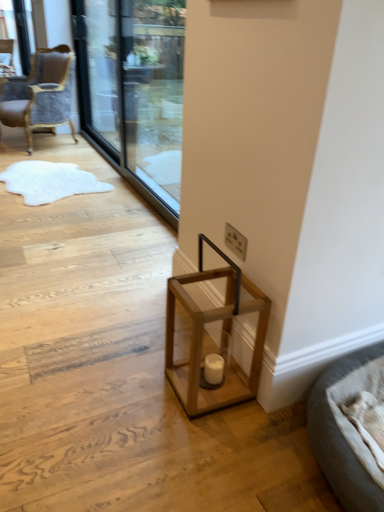
Where is `wooden lantern at lower center`? wooden lantern at lower center is located at coordinates (220, 344).

At what (x,y) coordinates should I click in order to perform the action: click on white plastic electric outlet at lower center. Please return your answer as a coordinate pair (x, y). This screenshot has height=512, width=384. Looking at the image, I should click on (235, 241).

Describe the element at coordinates (134, 90) in the screenshot. This screenshot has height=512, width=384. I see `transparent glass screen door at upper center, the 2th screen door viewed from the left` at that location.

This screenshot has height=512, width=384. Identify the location of velvet upholstered chair at upper left, the second chair positioned from the front. (6, 58).

Find the location of a particular element. This screenshot has height=512, width=384. gray fabric bed at lower right is located at coordinates (341, 439).

From the image's perspective, is velvet upholstered chair at upper left, which ranks as the 1th chair in back-to-front order, over transparent glass screen door at upper center, the 2th screen door viewed from the left?

Yes, from the image's perspective, velvet upholstered chair at upper left, which ranks as the 1th chair in back-to-front order, is above transparent glass screen door at upper center, the 2th screen door viewed from the left.

Can you tell me how much velvet upholstered chair at upper left, which ranks as the first chair in left-to-right order, and transparent glass screen door at upper center, the 2th screen door viewed from the left, differ in facing direction?

The facing directions of velvet upholstered chair at upper left, which ranks as the first chair in left-to-right order, and transparent glass screen door at upper center, the 2th screen door viewed from the left, are 56.9 degrees apart.

Which object is closer to the camera taking this photo, velvet upholstered chair at upper left, which ranks as the first chair in left-to-right order, or transparent glass screen door at upper center, placed as the 1th screen door when sorted from right to left?

transparent glass screen door at upper center, placed as the 1th screen door when sorted from right to left, is in front.

Is velvet upholstered chair at upper left, positioned as the second chair in bottom-to-top order, positioned beyond the bounds of transparent glass screen door at upper center, the 2th screen door viewed from the left?

That's correct, velvet upholstered chair at upper left, positioned as the second chair in bottom-to-top order, is outside of transparent glass screen door at upper center, the 2th screen door viewed from the left.

Considering the relative positions of gray fabric bed at lower right and transparent glass screen door at upper center, placed as the 1th screen door when sorted from right to left, in the image provided, is gray fabric bed at lower right to the left of transparent glass screen door at upper center, placed as the 1th screen door when sorted from right to left, from the viewer's perspective?

No.

Can you tell me how much gray fabric bed at lower right and transparent glass screen door at upper center, placed as the 1th screen door when sorted from right to left, differ in facing direction?

The facing directions of gray fabric bed at lower right and transparent glass screen door at upper center, placed as the 1th screen door when sorted from right to left, are 0.469 degrees apart.

Does point (352, 459) appear closer or farther from the camera than point (85, 65)?

Point (352, 459) appears to be closer to the viewer than point (85, 65).

Can transparent glass screen door at upper center, the 2th screen door viewed from the left, be found inside gray fabric bed at lower right?

No, gray fabric bed at lower right does not contain transparent glass screen door at upper center, the 2th screen door viewed from the left.

Is velvet upholstered chair at upper left, the first chair when ordered from top to bottom, at the right side of matte wooden candle holder at lower center?

No.

Does point (7, 48) appear closer or farther from the camera than point (221, 374)?

Clearly, point (7, 48) is more distant from the camera than point (221, 374).

Between velvet upholstered chair at upper left, which is the second chair in right-to-left order, and matte wooden candle holder at lower center, which one has smaller size?

matte wooden candle holder at lower center.

In the image, is transparent glass screen door at upper left, the 1th screen door when ordered from left to right, positioned in front of or behind white plastic electric outlet at lower center?

transparent glass screen door at upper left, the 1th screen door when ordered from left to right, is positioned farther from the viewer than white plastic electric outlet at lower center.

How different are the orientations of transparent glass screen door at upper left, the second screen door from the right, and white plastic electric outlet at lower center in degrees?

transparent glass screen door at upper left, the second screen door from the right, and white plastic electric outlet at lower center are facing 0.593 degrees away from each other.

I want to click on electric outlet beneath the transparent glass screen door at upper left, the second screen door from the right (from a real-world perspective), so click(235, 241).

Is transparent glass screen door at upper left, the 1th screen door when ordered from left to right, thinner than white plastic electric outlet at lower center?

In fact, transparent glass screen door at upper left, the 1th screen door when ordered from left to right, might be wider than white plastic electric outlet at lower center.

Are white plastic electric outlet at lower center and transparent glass screen door at upper center, the 2th screen door viewed from the left, located far from each other?

Indeed, white plastic electric outlet at lower center is not near transparent glass screen door at upper center, the 2th screen door viewed from the left.

Which point is more forward, (232, 231) or (126, 89)?

Point (232, 231)

From the image's perspective, which is above, white plastic electric outlet at lower center or transparent glass screen door at upper center, the 2th screen door viewed from the left?

transparent glass screen door at upper center, the 2th screen door viewed from the left.

Can you tell me how much white plastic electric outlet at lower center and transparent glass screen door at upper center, the 2th screen door viewed from the left, differ in facing direction?

The angular difference between white plastic electric outlet at lower center and transparent glass screen door at upper center, the 2th screen door viewed from the left, is 0.127 degrees.

How different are the orientations of velvet grey chair at upper left, acting as the second chair starting from the left, and wooden lantern at lower center in degrees?

There is a 21.1-degree angle between the facing directions of velvet grey chair at upper left, acting as the second chair starting from the left, and wooden lantern at lower center.

From the image's perspective, between velvet grey chair at upper left, the 1th chair in the bottom-to-top sequence, and wooden lantern at lower center, which one is located above?

velvet grey chair at upper left, the 1th chair in the bottom-to-top sequence, is shown above in the image.

From their relative heights in the image, would you say velvet grey chair at upper left, which appears as the first chair when viewed from the right, is taller or shorter than wooden lantern at lower center?

velvet grey chair at upper left, which appears as the first chair when viewed from the right, is taller than wooden lantern at lower center.

Is velvet grey chair at upper left, which ranks as the second chair in back-to-front order, situated inside wooden lantern at lower center or outside?

velvet grey chair at upper left, which ranks as the second chair in back-to-front order, is not enclosed by wooden lantern at lower center.

This screenshot has height=512, width=384. What are the coordinates of `candle holder on the left of the white plastic electric outlet at lower center` in the screenshot? It's located at (214, 369).

Does matte wooden candle holder at lower center appear on the left side of white plastic electric outlet at lower center?

Yes, matte wooden candle holder at lower center is to the left of white plastic electric outlet at lower center.

Considering the relative sizes of matte wooden candle holder at lower center and white plastic electric outlet at lower center in the image provided, is matte wooden candle holder at lower center smaller than white plastic electric outlet at lower center?

Actually, matte wooden candle holder at lower center might be larger than white plastic electric outlet at lower center.

Considering the sizes of objects matte wooden candle holder at lower center and white plastic electric outlet at lower center in the image provided, who is shorter, matte wooden candle holder at lower center or white plastic electric outlet at lower center?

matte wooden candle holder at lower center is shorter.

The image size is (384, 512). I want to click on chair that is the 2nd one when counting backward from the transparent glass screen door at upper center, the 2th screen door viewed from the left, so click(x=6, y=58).

The width and height of the screenshot is (384, 512). In the image, there is a transparent glass screen door at upper center, placed as the 1th screen door when sorted from right to left. Identify the location of furniture below it (from a real-world perspective). (341, 439).

Which object lies further to the anchor point matte wooden candle holder at lower center, white plastic electric outlet at lower center or velvet grey chair at upper left, the 2th chair in the top-to-bottom sequence?

The object further to matte wooden candle holder at lower center is velvet grey chair at upper left, the 2th chair in the top-to-bottom sequence.

Looking at the image, which one is located closer to matte wooden candle holder at lower center, transparent glass screen door at upper left, the second screen door from the right, or velvet upholstered chair at upper left, the second chair positioned from the front?

transparent glass screen door at upper left, the second screen door from the right.

Looking at the image, which one is located further to velvet grey chair at upper left, the 1th chair from the front, gray fabric bed at lower right or wooden lantern at lower center?

gray fabric bed at lower right is positioned further to the anchor velvet grey chair at upper left, the 1th chair from the front.

Estimate the real-world distances between objects in this image. Which object is further from transparent glass screen door at upper center, the 2th screen door viewed from the left, velvet grey chair at upper left, the 1th chair in the bottom-to-top sequence, or wooden lantern at lower center?

The object further to transparent glass screen door at upper center, the 2th screen door viewed from the left, is wooden lantern at lower center.

Considering their positions, is matte wooden candle holder at lower center positioned further to gray fabric bed at lower right than transparent glass screen door at upper center, the 2th screen door viewed from the left?

Among the two, transparent glass screen door at upper center, the 2th screen door viewed from the left, is located further to gray fabric bed at lower right.

Which object lies further to the anchor point matte wooden candle holder at lower center, velvet grey chair at upper left, the 1th chair from the front, or white plastic electric outlet at lower center?

velvet grey chair at upper left, the 1th chair from the front, is further to matte wooden candle holder at lower center.

Looking at the image, which one is located closer to velvet grey chair at upper left, acting as the second chair starting from the left, wooden lantern at lower center or transparent glass screen door at upper left, the 1th screen door when ordered from left to right?

Among the two, transparent glass screen door at upper left, the 1th screen door when ordered from left to right, is located nearer to velvet grey chair at upper left, acting as the second chair starting from the left.

From the image, which object appears to be nearer to matte wooden candle holder at lower center, velvet grey chair at upper left, acting as the second chair starting from the left, or wooden lantern at lower center?

wooden lantern at lower center is closer to matte wooden candle holder at lower center.

The height and width of the screenshot is (512, 384). Identify the location of candle holder between transparent glass screen door at upper left, the second screen door from the right, and gray fabric bed at lower right, in the vertical direction. (214, 369).

I want to click on candle holder located between gray fabric bed at lower right and velvet upholstered chair at upper left, the second chair positioned from the front, in the depth direction, so click(214, 369).

In order to click on candle holder positioned between wooden lantern at lower center and velvet grey chair at upper left, the 2th chair in the top-to-bottom sequence, from near to far in this screenshot , I will do click(x=214, y=369).

Image resolution: width=384 pixels, height=512 pixels. What are the coordinates of `electric outlet between transparent glass screen door at upper center, placed as the 1th screen door when sorted from right to left, and wooden lantern at lower center, in the vertical direction` in the screenshot? It's located at (235, 241).